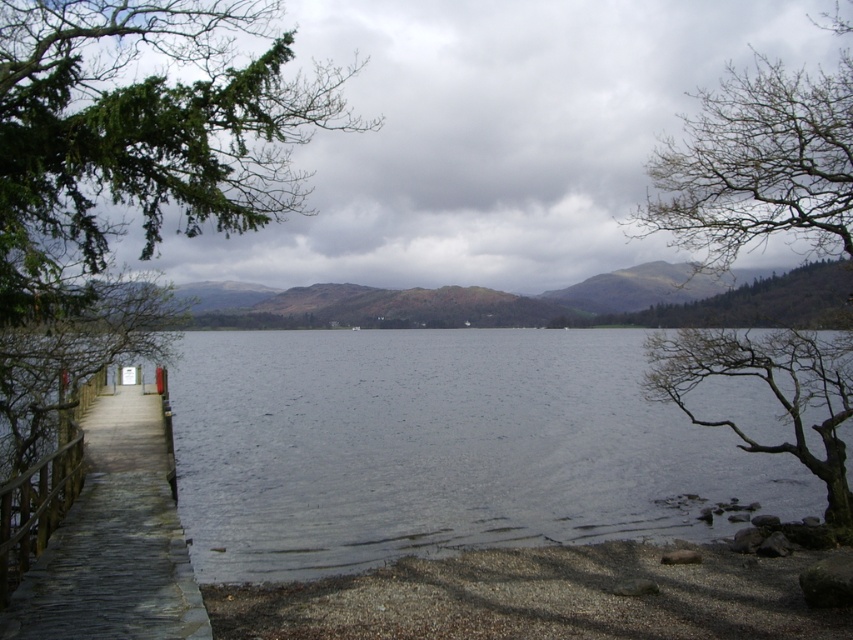
You are standing at the center of the wooden jetty and want to locate the green leafy tree at upper left. Based on the coordinates provided, in which direction should you look to see it?

The green leafy tree at upper left is located at coordinates point (141, 132), which is in the upper left direction from your position at the center of the wooden jetty.

You are standing at the edge of the lake and want to walk to the green leafy tree at upper left. However, there is a smooth gravel shore at lower right between you and the tree. Can you walk directly to the tree without crossing the gravel shore?

The green leafy tree at upper left is in front of the smooth gravel shore at lower right, meaning the tree is closer to you than the gravel shore. Therefore, you can walk directly to the green leafy tree at upper left without needing to cross the smooth gravel shore at lower right.

You are standing at the point labeled point (202, 508) and want to reach the farthest point on the lake without getting your shoes wet. The lake is 59.70 feet wide at this location. If your maximum walking distance without wetting your shoes is 60 feet, can you safely cross the lake to the opposite shore?

The lake is 59.70 feet wide at this location, which is just under your maximum walking distance of 60 feet. Therefore, you can safely cross the lake to the opposite shore without getting your shoes wet.